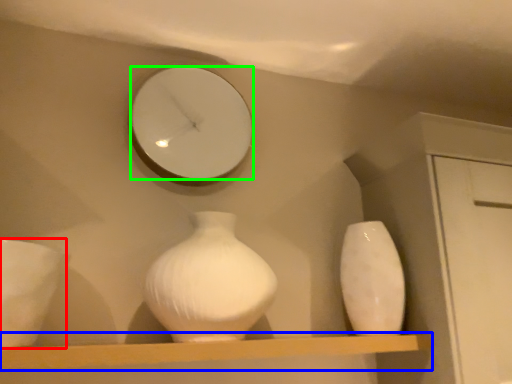
Question: Which is nearer to the porcelain (highlighted by a red box)? shelf (highlighted by a blue box) or mirror (highlighted by a green box).

Choices:
 (A) shelf
 (B) mirror

Answer: (A)